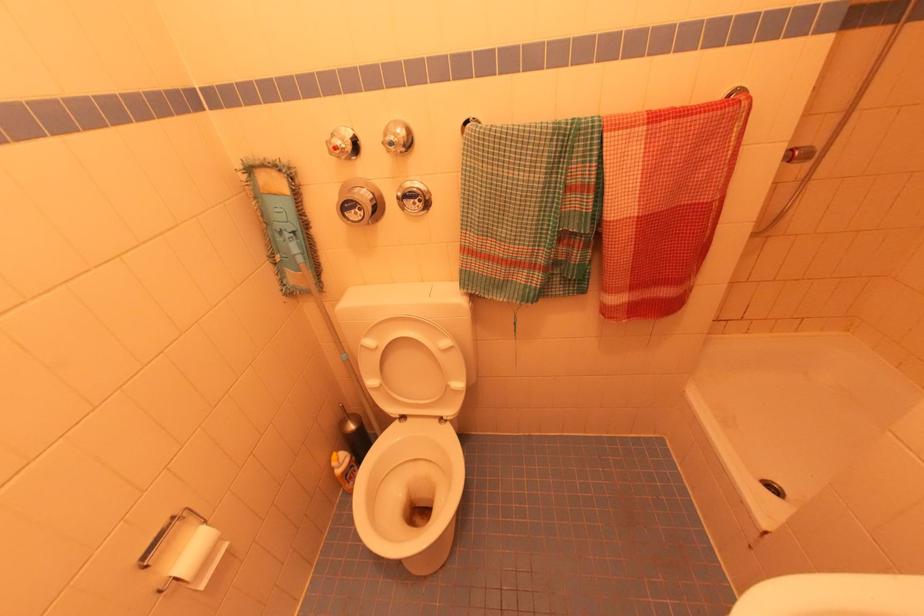
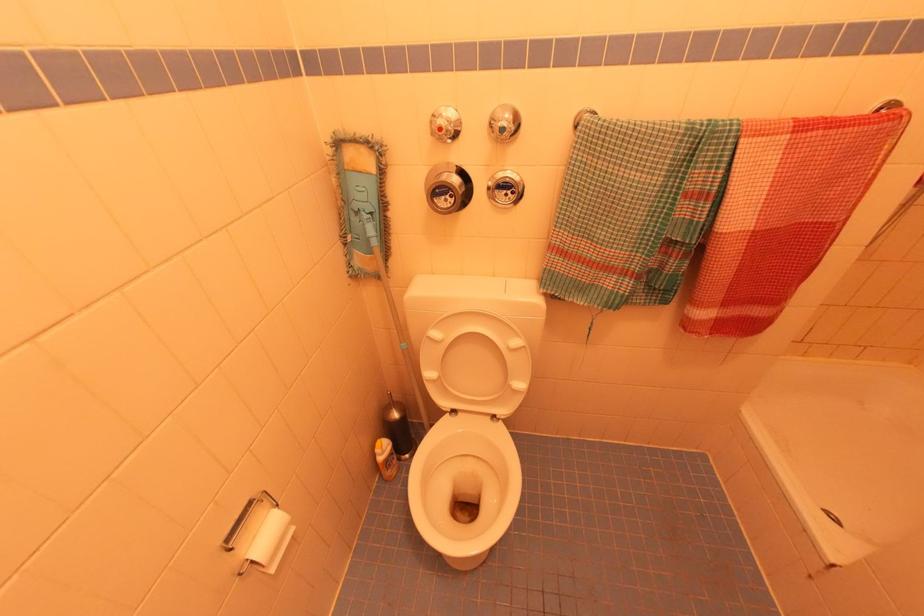
In the second image, find the point that corresponds to point 355,212 in the first image.

(444, 198)